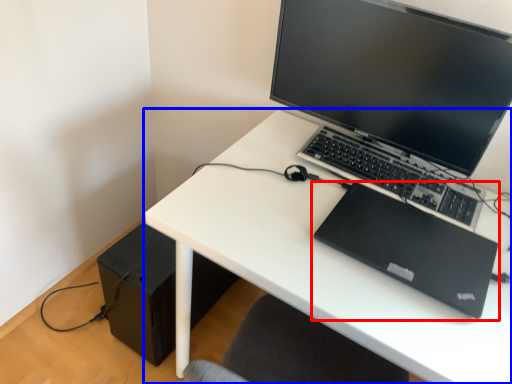
Question: Which of the following is the farthest to the observer, laptop (highlighted by a red box) or desk (highlighted by a blue box)?

Choices:
 (A) laptop
 (B) desk

Answer: (A)